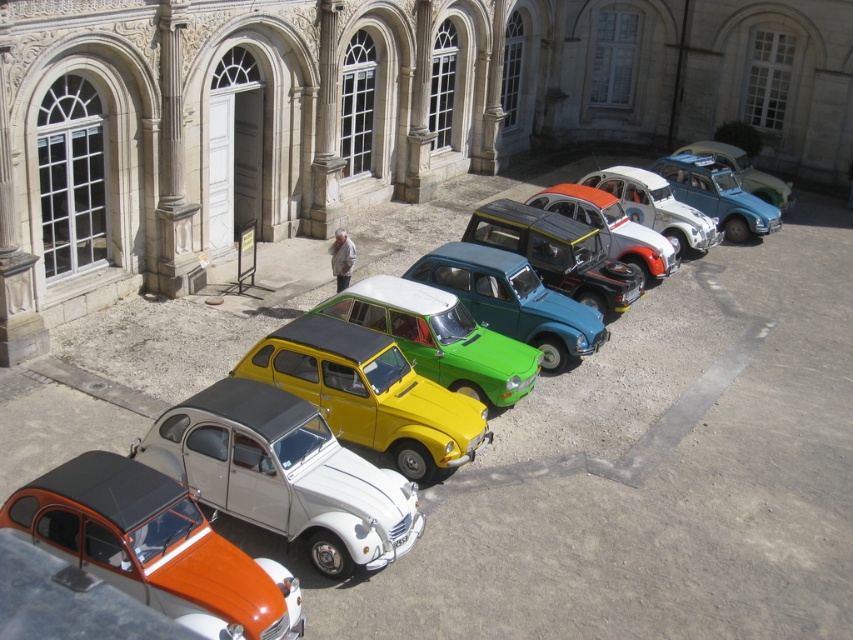
Question: Which point appears closest to the camera in this image?

Choices:
 (A) tap(36, 481)
 (B) tap(459, 406)
 (C) tap(44, 392)
 (D) tap(412, 483)

Answer: (A)

Question: Does orange matte car at lower left have a smaller size compared to metallic silver car at center?

Choices:
 (A) yes
 (B) no

Answer: (A)

Question: Which of the following is the farthest from the observer?

Choices:
 (A) yellow matte toy car at center
 (B) orange matte car at lower left

Answer: (A)

Question: Among these objects, which one is farthest from the camera?

Choices:
 (A) metallic silver car at center
 (B) white matte car at center
 (C) matte black car at center
 (D) orange matte car at lower left

Answer: (A)

Question: Observing the image, what is the correct spatial positioning of white matte car at center in reference to matte green car at center?

Choices:
 (A) below
 (B) above

Answer: (A)

Question: Can you confirm if white matte car at center is positioned to the right of orange matte car at lower left?

Choices:
 (A) no
 (B) yes

Answer: (B)